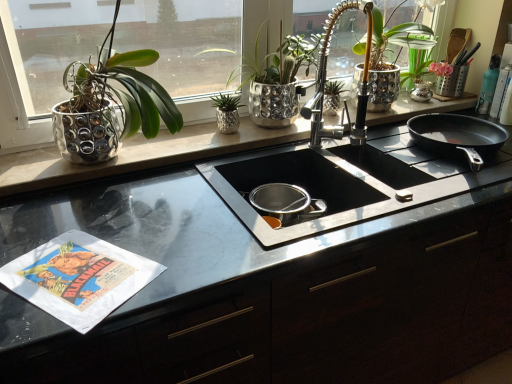
Find the location of `vacant space in between shiny metallic plant at left, which appears as the first houseplant when viewed from the left, and green metallic plant at center, which is the 2th houseplant in left-to-right order`. vacant space in between shiny metallic plant at left, which appears as the first houseplant when viewed from the left, and green metallic plant at center, which is the 2th houseplant in left-to-right order is located at coordinates click(200, 142).